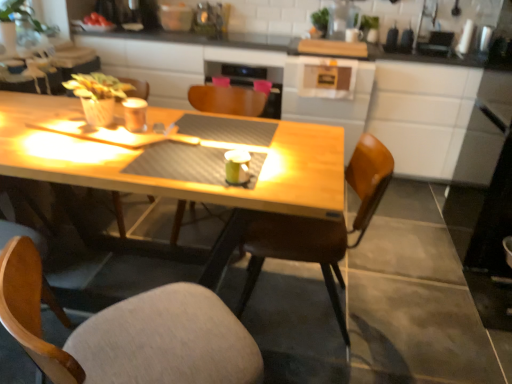
Identify the location of vacant space positioned to the left of green matte mug at center, which is counted as the 1th coffee cup, starting from the front. Image resolution: width=512 pixels, height=384 pixels. (193, 171).